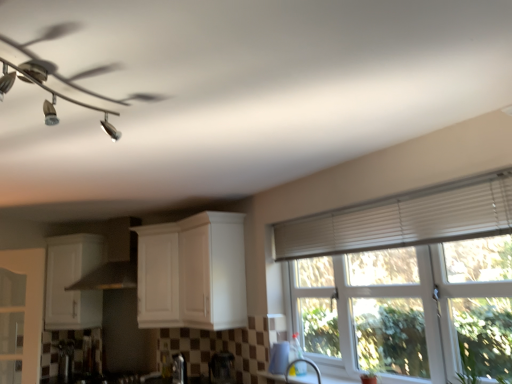
Describe the element at coordinates (65, 360) in the screenshot. I see `satin silver kettle at lower left, positioned as the 1th appliance in left-to-right order` at that location.

The height and width of the screenshot is (384, 512). Describe the element at coordinates (72, 282) in the screenshot. I see `white matte cabinet at lower left, which is the 1th cabinetry from left to right` at that location.

Find the location of `white textured blinds at upper right`. white textured blinds at upper right is located at coordinates (404, 219).

Image resolution: width=512 pixels, height=384 pixels. What do you see at coordinates (222, 368) in the screenshot? I see `metallic silver kettle at lower center, which is the 2th appliance in right-to-left order` at bounding box center [222, 368].

This screenshot has width=512, height=384. In order to click on satin silver kettle at lower left, positioned as the 1th appliance in left-to-right order in this screenshot , I will do 65,360.

Is white glossy cup at lower center, the first appliance when ordered from right to left, not within white matte cabinet at lower left, marked as the second cabinetry in a right-to-left arrangement?

Yes, white glossy cup at lower center, the first appliance when ordered from right to left, is outside of white matte cabinet at lower left, marked as the second cabinetry in a right-to-left arrangement.

Is white glossy cup at lower center, the first appliance when ordered from right to left, far from white matte cabinet at lower left, marked as the second cabinetry in a right-to-left arrangement?

Yes.

Measure the distance from white glossy cup at lower center, the first appliance when ordered from right to left, to white matte cabinet at lower left, marked as the second cabinetry in a right-to-left arrangement.

6.57 feet.

Considering the positions of points (286, 338) and (53, 253), is point (286, 338) closer to camera compared to point (53, 253)?

That is True.

Looking at this image, who is shorter, satin silver toaster at lower center, which ranks as the 3th appliance in front-to-back order, or metallic silver kettle at lower center, the 4th appliance positioned from the back?

satin silver toaster at lower center, which ranks as the 3th appliance in front-to-back order, is shorter.

Who is smaller, satin silver toaster at lower center, acting as the third appliance starting from the right, or metallic silver kettle at lower center, the 4th appliance positioned from the back?

satin silver toaster at lower center, acting as the third appliance starting from the right.

Which is farther from the camera, (177, 371) or (216, 360)?

The point (177, 371) is more distant.

Considering the positions of objects satin silver toaster at lower center, the third appliance positioned from the back, and metallic silver kettle at lower center, the 2th appliance positioned from the front, in the image provided, who is more to the left, satin silver toaster at lower center, the third appliance positioned from the back, or metallic silver kettle at lower center, the 2th appliance positioned from the front,?

From the viewer's perspective, satin silver toaster at lower center, the third appliance positioned from the back, appears more on the left side.

Is point (470, 319) closer to viewer compared to point (176, 362)?

Yes.

From the picture: Is white textured window at upper right aimed at satin silver toaster at lower center, acting as the third appliance starting from the right?

No, white textured window at upper right is not facing towards satin silver toaster at lower center, acting as the third appliance starting from the right.

Between white textured window at upper right and satin silver toaster at lower center, which ranks as the 3th appliance in front-to-back order, which one has more height?

white textured window at upper right.

From the image's perspective, between white textured window at upper right and satin silver toaster at lower center, the 3th appliance in the left-to-right sequence, which one is located above?

white textured window at upper right appears higher in the image.

From the picture: Is metallic silver ceiling fan at upper left positioned with its back to white textured blinds at upper right?

That's right, metallic silver ceiling fan at upper left is facing away from white textured blinds at upper right.

Identify the location of ceiling fan that is on the left side of white textured blinds at upper right. (63, 76).

Based on the photo, are metallic silver ceiling fan at upper left and white textured blinds at upper right far apart?

Yes, metallic silver ceiling fan at upper left and white textured blinds at upper right are quite far apart.

From the image's perspective, is metallic silver ceiling fan at upper left below white textured blinds at upper right?

No, from the image's perspective, metallic silver ceiling fan at upper left is not beneath white textured blinds at upper right.

Is white textured blinds at upper right taller or shorter than white matte cabinet at lower left, which is the 1th cabinetry from left to right?

white textured blinds at upper right is shorter than white matte cabinet at lower left, which is the 1th cabinetry from left to right.

From the image's perspective, is white textured blinds at upper right positioned above or below white matte cabinet at lower left, marked as the second cabinetry in a right-to-left arrangement?

Clearly, from the image's perspective, white textured blinds at upper right is above white matte cabinet at lower left, marked as the second cabinetry in a right-to-left arrangement.

From a real-world perspective, which is physically above, white textured blinds at upper right or white matte cabinet at lower left, marked as the second cabinetry in a right-to-left arrangement?

white textured blinds at upper right is physically above.

Is white textured blinds at upper right positioned far away from white matte cabinet at lower left, which is the 1th cabinetry from left to right?

Absolutely, white textured blinds at upper right is distant from white matte cabinet at lower left, which is the 1th cabinetry from left to right.

Looking at the image, does metallic stainless steel kettle at lower left, the fourth appliance in the front-to-back sequence, seem bigger or smaller compared to white textured blinds at upper right?

Clearly, metallic stainless steel kettle at lower left, the fourth appliance in the front-to-back sequence, is smaller in size than white textured blinds at upper right.

From a real-world perspective, is metallic stainless steel kettle at lower left, the fourth appliance in the front-to-back sequence, over white textured blinds at upper right?

No, from a real-world perspective, metallic stainless steel kettle at lower left, the fourth appliance in the front-to-back sequence, is not on top of white textured blinds at upper right.

Is metallic stainless steel kettle at lower left, which is counted as the 4th appliance, starting from the right, beside white textured blinds at upper right?

They are not placed beside each other.

Is metallic stainless steel kettle at lower left, which is counted as the 4th appliance, starting from the right, oriented towards white textured blinds at upper right?

No, metallic stainless steel kettle at lower left, which is counted as the 4th appliance, starting from the right, is not oriented towards white textured blinds at upper right.

Does white glossy cabinet at center, the second cabinetry positioned from the left, turn towards metallic silver ceiling fan at upper left?

No.

Does point (219, 329) come closer to viewer compared to point (67, 97)?

No, it is not.

From a real-world perspective, is white glossy cabinet at center, the 1th cabinetry when ordered from right to left, positioned above or below metallic silver ceiling fan at upper left?

Clearly, from a real-world perspective, white glossy cabinet at center, the 1th cabinetry when ordered from right to left, is below metallic silver ceiling fan at upper left.

Identify the location of the 2nd cabinetry to the left of the white glossy cup at lower center, the first appliance when ordered from right to left, starting your count from the anchor. Image resolution: width=512 pixels, height=384 pixels. (72, 282).

Starting from the metallic silver kettle at lower center, which is the 2th appliance in right-to-left order, which appliance is the 1st one behind? Please provide its 2D coordinates.

[(179, 369)]

Considering their positions, is metallic stainless steel kettle at lower left, the fourth appliance in the front-to-back sequence, positioned closer to white matte cabinet at lower left, marked as the second cabinetry in a right-to-left arrangement, than white textured blinds at upper right?

metallic stainless steel kettle at lower left, the fourth appliance in the front-to-back sequence, is closer to white matte cabinet at lower left, marked as the second cabinetry in a right-to-left arrangement.

Consider the image. Based on their spatial positions, is white glossy cup at lower center, the 1th appliance from the front, or satin nickel faucet at lower center closer to metallic stainless steel kettle at lower left, which is the second appliance in left-to-right order?

Among the two, white glossy cup at lower center, the 1th appliance from the front, is located nearer to metallic stainless steel kettle at lower left, which is the second appliance in left-to-right order.

Consider the image. When comparing their distances from satin nickel faucet at lower center, does white textured window at upper right or metallic silver ceiling fan at upper left seem closer?

white textured window at upper right is closer to satin nickel faucet at lower center.

Based on the photo, estimate the real-world distances between objects in this image. Which object is closer to white matte cabinet at lower left, which is the 1th cabinetry from left to right, metallic stainless steel kettle at lower left, which is counted as the 4th appliance, starting from the right, or satin silver kettle at lower left, which ranks as the first appliance in back-to-front order?

metallic stainless steel kettle at lower left, which is counted as the 4th appliance, starting from the right, is positioned closer to the anchor white matte cabinet at lower left, which is the 1th cabinetry from left to right.

From the picture: Looking at the image, which one is located closer to satin silver kettle at lower left, which appears as the fifth appliance when viewed from the front, white glossy cup at lower center, which is counted as the fifth appliance, starting from the left, or white glossy cabinet at center, the second cabinetry positioned from the left?

white glossy cabinet at center, the second cabinetry positioned from the left, lies closer to satin silver kettle at lower left, which appears as the fifth appliance when viewed from the front, than the other object.

Looking at the image, which one is located further to metallic silver kettle at lower center, the 4th appliance positioned from the back, metallic silver ceiling fan at upper left or metallic stainless steel kettle at lower left, the fourth appliance in the front-to-back sequence?

metallic silver ceiling fan at upper left is further to metallic silver kettle at lower center, the 4th appliance positioned from the back.

Considering their positions, is metallic silver kettle at lower center, the 2th appliance positioned from the front, positioned further to metallic stainless steel kettle at lower left, which is the second appliance in left-to-right order, than satin nickel faucet at lower center?

satin nickel faucet at lower center is positioned further to the anchor metallic stainless steel kettle at lower left, which is the second appliance in left-to-right order.

When comparing their distances from satin silver toaster at lower center, the 3th appliance in the left-to-right sequence, does metallic silver kettle at lower center, the 4th appliance positioned from the back, or metallic silver ceiling fan at upper left seem closer?

metallic silver kettle at lower center, the 4th appliance positioned from the back, lies closer to satin silver toaster at lower center, the 3th appliance in the left-to-right sequence, than the other object.

This screenshot has height=384, width=512. Identify the location of faucet between metallic silver ceiling fan at upper left and white textured window at upper right from left to right. (304, 362).

This screenshot has width=512, height=384. In order to click on faucet between metallic silver ceiling fan at upper left and white matte cabinet at lower left, which is the 1th cabinetry from left to right, from front to back in this screenshot , I will do `click(304, 362)`.

Find the location of a particular element. The image size is (512, 384). faucet between satin silver kettle at lower left, which appears as the fifth appliance when viewed from the front, and white textured blinds at upper right from left to right is located at coordinates (304, 362).

Locate an element on the screen. The width and height of the screenshot is (512, 384). cabinetry located between white matte cabinet at lower left, which is the 1th cabinetry from left to right, and satin silver toaster at lower center, the third appliance positioned from the back, in the left-right direction is located at coordinates [x=192, y=273].